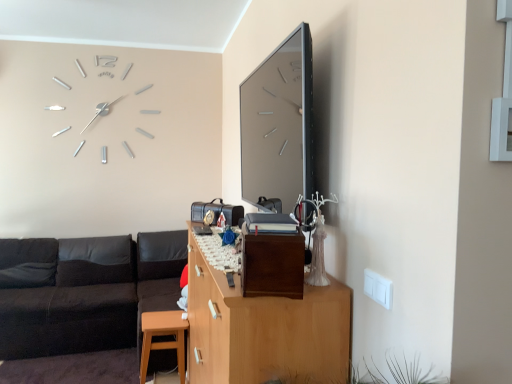
Identify the location of black leather couch at left. (85, 291).

The height and width of the screenshot is (384, 512). What do you see at coordinates (272, 258) in the screenshot?
I see `brown matte/file cabinet at center` at bounding box center [272, 258].

Image resolution: width=512 pixels, height=384 pixels. Identify the location of brown matte/file cabinet at center. (272, 258).

Find the location of `wooden cabinet at center`. wooden cabinet at center is located at coordinates (264, 330).

Describe the element at coordinates (163, 335) in the screenshot. I see `matte wood stool at lower left` at that location.

I want to click on black leather couch at left, so click(85, 291).

Is point (178, 255) positioned behind point (253, 283)?

Yes, point (178, 255) is farther from viewer.

Which is behind, black leather couch at lower left or brown matte/file cabinet at center?

black leather couch at lower left is more distant.

Is black leather couch at lower left oriented towards brown matte/file cabinet at center?

Yes, black leather couch at lower left is facing brown matte/file cabinet at center.

Based on the photo, is black leather couch at lower left beside brown matte/file cabinet at center?

No, black leather couch at lower left is not touching brown matte/file cabinet at center.

Is black leather couch at left oriented away from wooden cabinet at center?

No, wooden cabinet at center is not at the back of black leather couch at left.

Is black leather couch at left taller than wooden cabinet at center?

In fact, black leather couch at left may be shorter than wooden cabinet at center.

Considering the relative sizes of black leather couch at left and wooden cabinet at center in the image provided, is black leather couch at left thinner than wooden cabinet at center?

No.

Is black leather couch at lower left positioned in front of black leather couch at left?

No, it is behind black leather couch at left.

The width and height of the screenshot is (512, 384). Find the location of `couch located above the black leather couch at left (from the image's perspective)`. couch located above the black leather couch at left (from the image's perspective) is located at coordinates (159, 273).

Does black leather couch at lower left have a larger size compared to black leather couch at left?

Incorrect, black leather couch at lower left is not larger than black leather couch at left.

Looking at this image, from the image's perspective, does black leather couch at lower left appear lower than black leather couch at left?

No.

Which object is more forward, brown matte/file cabinet at center or matte wood stool at lower left?

brown matte/file cabinet at center is closer to the camera.

Where is `file cabinet located in front of the matte wood stool at lower left`? file cabinet located in front of the matte wood stool at lower left is located at coordinates [x=272, y=258].

From a real-world perspective, is brown matte/file cabinet at center physically located above or below matte wood stool at lower left?

brown matte/file cabinet at center is situated higher than matte wood stool at lower left in the real world.

Considering the positions of point (287, 260) and point (197, 262), is point (287, 260) closer or farther from the camera than point (197, 262)?

Point (287, 260) is positioned closer to the camera compared to point (197, 262).

From a real-world perspective, is brown matte/file cabinet at center physically above wooden cabinet at center?

Yes, from a real-world perspective, brown matte/file cabinet at center is above wooden cabinet at center.

In terms of size, does brown matte/file cabinet at center appear bigger or smaller than wooden cabinet at center?

Clearly, brown matte/file cabinet at center is smaller in size than wooden cabinet at center.

Where is `studio couch that is on the left side of wooden cabinet at center`? The height and width of the screenshot is (384, 512). studio couch that is on the left side of wooden cabinet at center is located at coordinates (85, 291).

Based on the photo, is wooden cabinet at center positioned beyond the bounds of black leather couch at left?

Yes, wooden cabinet at center is located beyond the bounds of black leather couch at left.

Considering the relative sizes of wooden cabinet at center and black leather couch at left in the image provided, is wooden cabinet at center thinner than black leather couch at left?

Yes, wooden cabinet at center is thinner than black leather couch at left.

From a real-world perspective, is wooden cabinet at center beneath black leather couch at left?

Incorrect, from a real-world perspective, wooden cabinet at center is higher than black leather couch at left.

Considering the positions of objects matte wood stool at lower left and wooden cabinet at center in the image provided, who is more to the left, matte wood stool at lower left or wooden cabinet at center?

From the viewer's perspective, matte wood stool at lower left appears more on the left side.

Is matte wood stool at lower left in front of wooden cabinet at center?

No.

Would you say wooden cabinet at center is part of matte wood stool at lower left's contents?

Actually, wooden cabinet at center is outside matte wood stool at lower left.

Does matte wood stool at lower left have a smaller size compared to wooden cabinet at center?

A: Yes, matte wood stool at lower left is smaller than wooden cabinet at center.

Locate an element on the screen. This screenshot has width=512, height=384. couch behind the brown matte/file cabinet at center is located at coordinates (159, 273).

Find the location of a particular element. The height and width of the screenshot is (384, 512). cabinetry above the black leather couch at left (from the image's perspective) is located at coordinates (264, 330).

Considering their positions, is black leather couch at left positioned further to black leather couch at lower left than matte wood stool at lower left?

The object further to black leather couch at lower left is matte wood stool at lower left.

Looking at the image, which one is located further to matte wood stool at lower left, brown matte/file cabinet at center or black leather couch at lower left?

brown matte/file cabinet at center is positioned further to the anchor matte wood stool at lower left.

When comparing their distances from wooden cabinet at center, does brown matte/file cabinet at center or matte wood stool at lower left seem further?

Among the two, matte wood stool at lower left is located further to wooden cabinet at center.

Which object lies further to the anchor point black leather couch at left, brown matte/file cabinet at center or black leather couch at lower left?

Among the two, brown matte/file cabinet at center is located further to black leather couch at left.

From the picture: From the image, which object appears to be nearer to brown matte/file cabinet at center, black leather couch at lower left or wooden cabinet at center?

Based on the image, wooden cabinet at center appears to be nearer to brown matte/file cabinet at center.

From the image, which object appears to be nearer to black leather couch at left, brown matte/file cabinet at center or matte wood stool at lower left?

Among the two, matte wood stool at lower left is located nearer to black leather couch at left.

Considering their positions, is matte wood stool at lower left positioned further to wooden cabinet at center than black leather couch at left?

The object further to wooden cabinet at center is black leather couch at left.

Looking at the image, which one is located further to black leather couch at lower left, matte wood stool at lower left or black leather couch at left?

matte wood stool at lower left lies further to black leather couch at lower left than the other object.

The height and width of the screenshot is (384, 512). I want to click on studio couch between brown matte/file cabinet at center and black leather couch at lower left in the front-back direction, so click(x=85, y=291).

This screenshot has height=384, width=512. Identify the location of table between brown matte/file cabinet at center and black leather couch at lower left from front to back. (163, 335).

Locate an element on the screen. cabinetry between black leather couch at left and brown matte/file cabinet at center in the horizontal direction is located at coordinates (264, 330).

In order to click on studio couch positioned between brown matte/file cabinet at center and matte wood stool at lower left from near to far in this screenshot , I will do `click(85, 291)`.